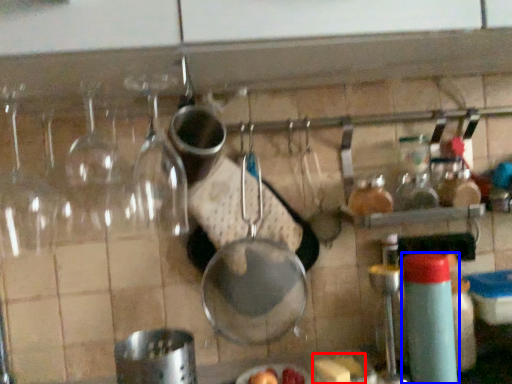
Question: Which object appears farthest to the camera in this image, food (highlighted by a red box) or bottle (highlighted by a blue box)?

Choices:
 (A) food
 (B) bottle

Answer: (A)